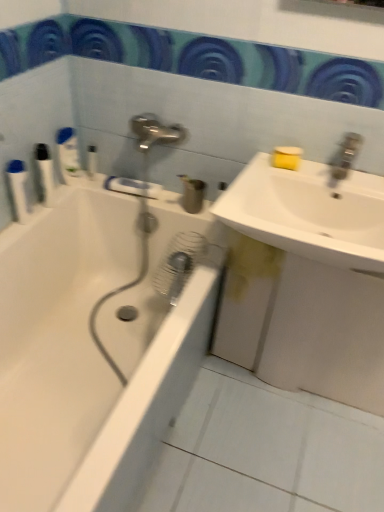
At what (x,y) coordinates should I click in order to perform the action: click on vacant space in front of white plastic bottle at upper left, the fourth toiletry positioned from the left. Please return your answer as a coordinate pair (x, y). This screenshot has height=512, width=384. Looking at the image, I should click on (91, 189).